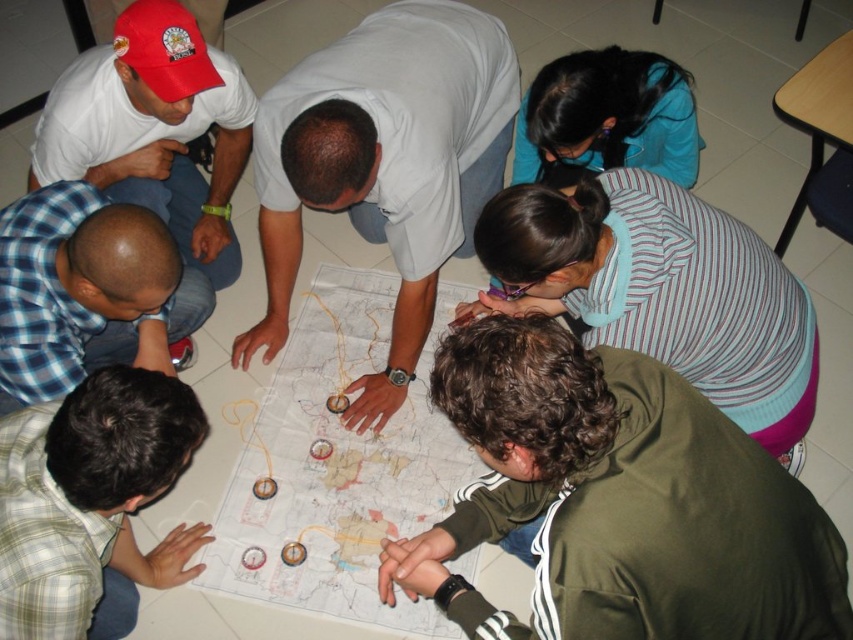
Looking at this image, is white paper map at center positioned before green plaid shirt at lower left?

No, it is not.

Is point (241, 529) less distant than point (102, 451)?

No, (241, 529) is further to viewer.

At what (x,y) coordinates should I click in order to perform the action: click on white paper map at center. Please return your answer as a coordinate pair (x, y). The height and width of the screenshot is (640, 853). Looking at the image, I should click on (338, 465).

Find the location of `white paper map at center`. white paper map at center is located at coordinates (338, 465).

Which is more to the right, green matte jacket at lower right or striped fabric shirt at lower center?

striped fabric shirt at lower center is more to the right.

Does point (576, 364) come in front of point (621, 285)?

Yes, point (576, 364) is closer to viewer.

Where is `green matte jacket at lower right`? The image size is (853, 640). green matte jacket at lower right is located at coordinates (618, 500).

Who is shorter, green matte jacket at lower right or blue fabric shirt at upper center?

blue fabric shirt at upper center

Which is more to the right, green matte jacket at lower right or blue fabric shirt at upper center?

blue fabric shirt at upper center is more to the right.

Describe the element at coordinates (618, 500) in the screenshot. I see `green matte jacket at lower right` at that location.

Identify the location of green matte jacket at lower right. Image resolution: width=853 pixels, height=640 pixels. (618, 500).